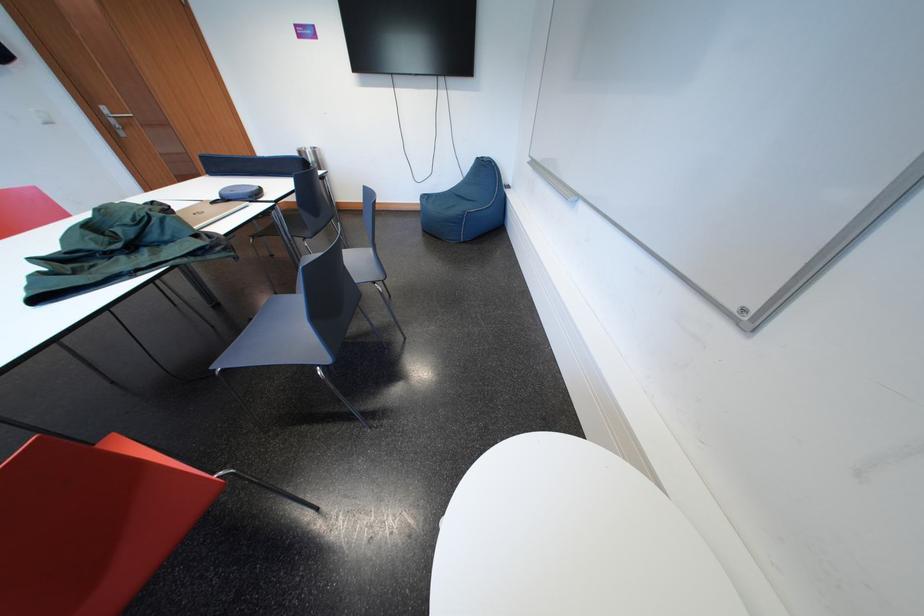
Find where to plac the whiteboard marker tray. Please return your answer as a coordinate pair (x, y).

(208, 212)